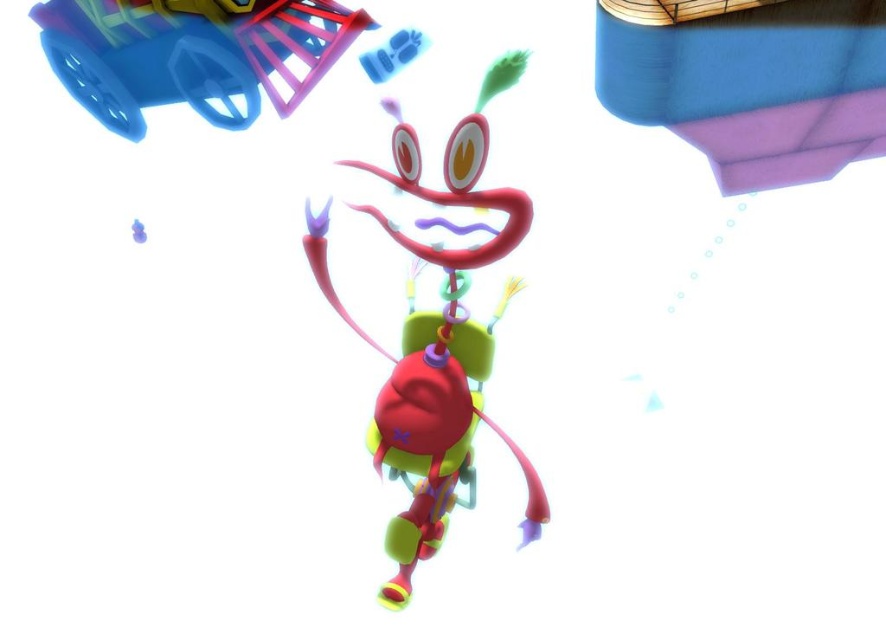
You are a child who wants to reach the glossy plastic toy at center and the rubberized plastic wagon at upper left. Which object is closer to your right side?

The glossy plastic toy at center is to the right of the rubberized plastic wagon at upper left, so it is closer to your right side.

You are a child who is 1.5 meters tall. You see the glossy plastic toy at center. Can you reach it?

The glossy plastic toy at center is 1.81 meters away from the camera, so the child who is 1.5 meters tall cannot reach it.